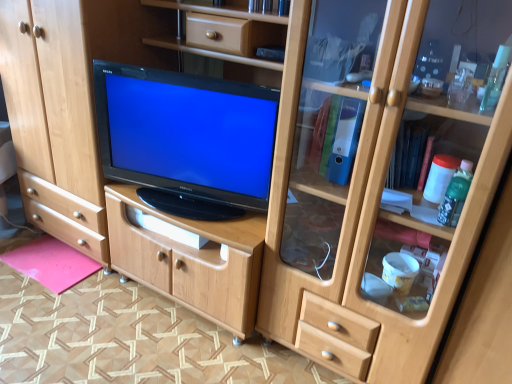
Locate an element on the screen. free space below pink matte mat at lower left (from a real-world perspective) is located at coordinates (39, 262).